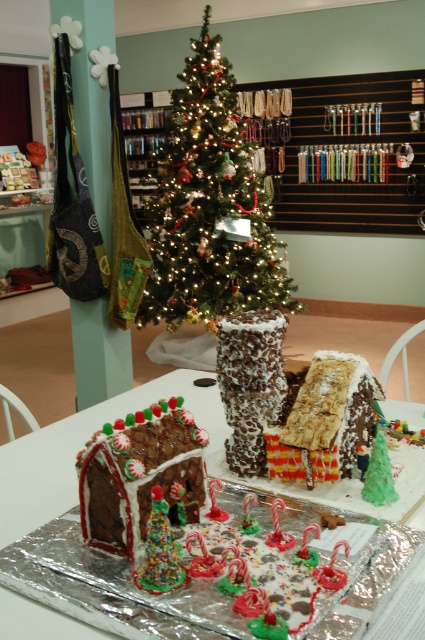
You are standing at the center of the room and looking towards the festive display. There are two points marked in the scene, point 1 at coordinates point (x=141, y=394) and point 2 at coordinates point (x=258, y=388). Which point is closer to you?

Point 2 at coordinates point (x=258, y=388) is closer to you because it is in front of point 1 at coordinates point (x=141, y=394).

You are a visitor at the festive display and want to take a photo of both the chocolate cake at center and the chocolate frosted gingerbread house at center. Since you want both to be fully visible in the photo, which object should you position closer to the camera to ensure they both fit in the frame?

The chocolate cake at center might be wider than the chocolate frosted gingerbread house at center, so to ensure both fit in the frame, position the chocolate frosted gingerbread house at center closer to the camera.

You are planning to take a photo of the festive display. The green matte christmas tree at center and the chocolate cake at center are both in the frame. Which object will appear larger in the photo?

The green matte christmas tree at center will appear larger in the photo because it is much taller than the chocolate cake at center.